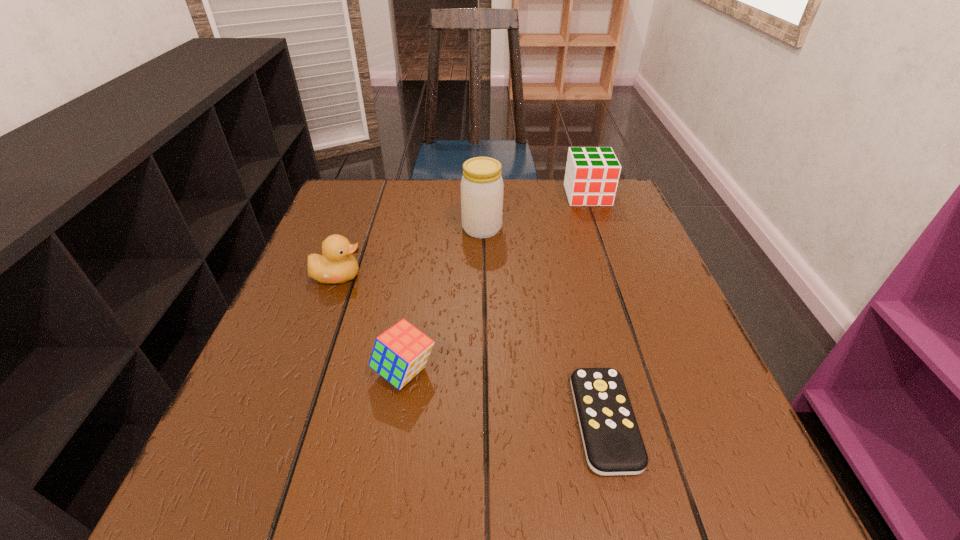
This screenshot has width=960, height=540. I want to click on empty location between the tallest object and the shorter cube, so click(x=444, y=300).

At what (x,y) coordinates should I click in order to perform the action: click on vacant space in between the taller cube and the tallest object. Please return your answer as a coordinate pair (x, y). The height and width of the screenshot is (540, 960). Looking at the image, I should click on (535, 212).

At what (x,y) coordinates should I click in order to perform the action: click on vacant area that lies between the nearer cube and the shortest object. Please return your answer as a coordinate pair (x, y). This screenshot has height=540, width=960. Looking at the image, I should click on (505, 396).

At what (x,y) coordinates should I click in order to perform the action: click on empty space that is in between the leftmost object and the second object from left to right. Please return your answer as a coordinate pair (x, y). This screenshot has width=960, height=540. Looking at the image, I should click on (372, 323).

The height and width of the screenshot is (540, 960). What are the coordinates of `vacant area that lies between the tallest object and the farthest object` in the screenshot? It's located at (535, 212).

Locate an element on the screen. unoccupied position between the second object from left to right and the right cube is located at coordinates (496, 284).

You are a GUI agent. You are given a task and a screenshot of the screen. Output one action in this format:
    pyautogui.click(x=<x>, y=<y>)
    Task: Click on the blank region between the taller cube and the shorter cube
    
    Given the screenshot: What is the action you would take?
    pyautogui.click(x=496, y=284)

At what (x,y) coordinates should I click in order to perform the action: click on empty space between the taller cube and the remote control. Please return your answer as a coordinate pair (x, y). Looking at the image, I should click on pos(596,308).

Find the location of a particular element. vacant space in between the nearer cube and the tallest object is located at coordinates (444, 300).

Point out which object is positioned as the fourth nearest to the shortest object. Please provide its 2D coordinates. Your answer should be formatted as a tuple, i.e. [(x, y)], where the tuple contains the x and y coordinates of a point satisfying the conditions above.

[(591, 179)]